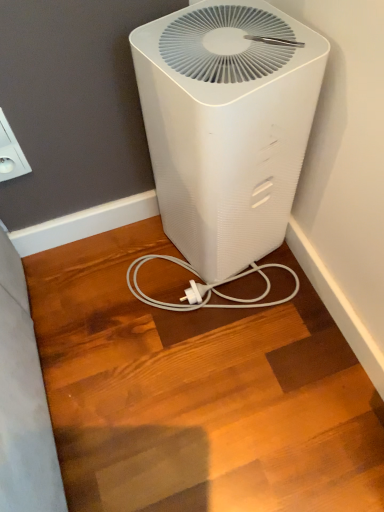
Question: Based on their sizes in the image, would you say white plastic outlet at upper left is bigger or smaller than white plastic air purifier at center?

Choices:
 (A) big
 (B) small

Answer: (B)

Question: Is point (6, 133) positioned closer to the camera than point (281, 131)?

Choices:
 (A) farther
 (B) closer

Answer: (A)

Question: Considering the relative positions of white plastic outlet at upper left and white plastic air purifier at center in the image provided, is white plastic outlet at upper left to the left or to the right of white plastic air purifier at center?

Choices:
 (A) right
 (B) left

Answer: (B)

Question: In terms of width, does white plastic air purifier at center look wider or thinner when compared to white plastic outlet at upper left?

Choices:
 (A) thin
 (B) wide

Answer: (B)

Question: Would you say white plastic air purifier at center is to the left or to the right of white plastic outlet at upper left in the picture?

Choices:
 (A) right
 (B) left

Answer: (A)

Question: Considering the positions of point (172, 64) and point (18, 145), is point (172, 64) closer or farther from the camera than point (18, 145)?

Choices:
 (A) closer
 (B) farther

Answer: (A)

Question: In the image, is white plastic air purifier at center positioned in front of or behind white plastic outlet at upper left?

Choices:
 (A) front
 (B) behind

Answer: (A)